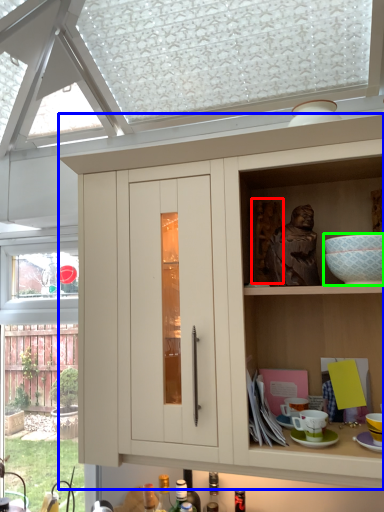
Question: Which object is positioned closest to sculpture (highlighted by a red box)? Select from cabinetry (highlighted by a blue box) and mixing bowl (highlighted by a green box).

Choices:
 (A) cabinetry
 (B) mixing bowl

Answer: (B)